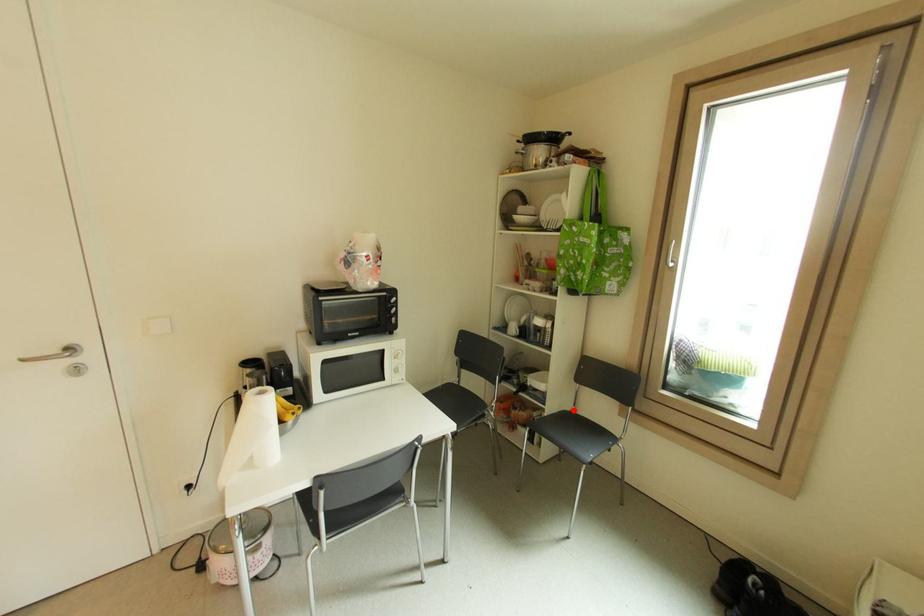
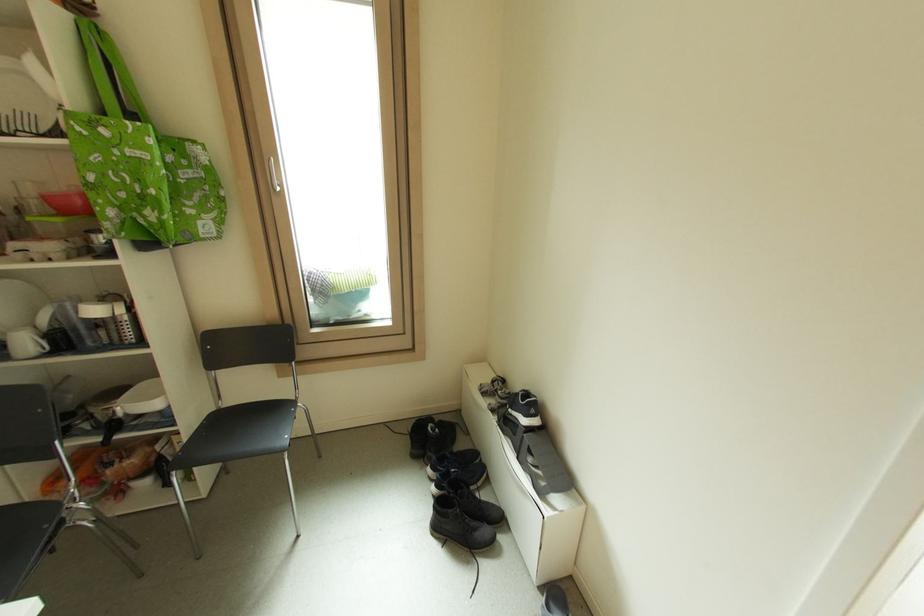
Question: I am providing you with two images of the same scene from different viewpoints. Image1 has a red point marked. In image2, the corresponding 3D location appears at what relative position? Reply with the corresponding letter.

Choices:
 (A) Closer
 (B) Farther

Answer: (A)